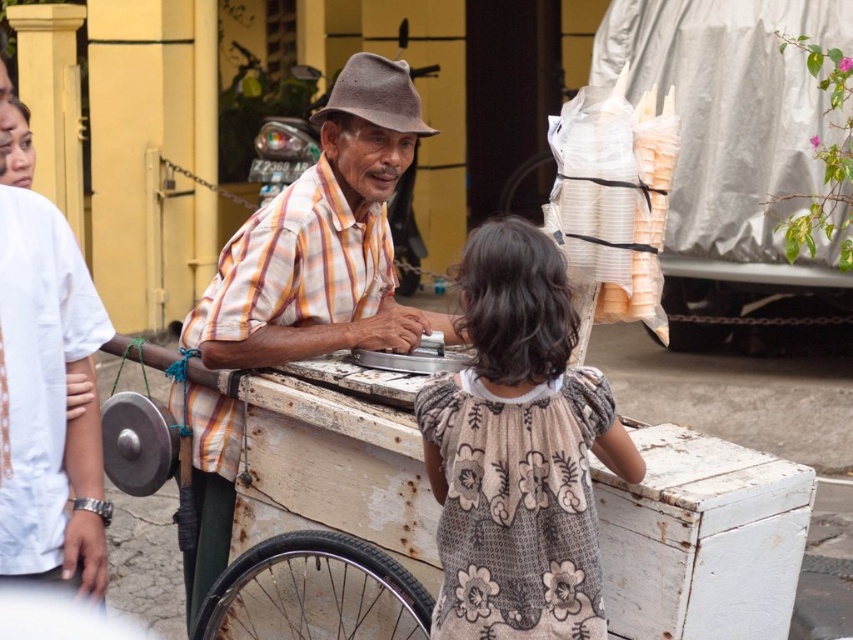
Is white weathered cart at center taller than plaid shirt at center?

Incorrect, white weathered cart at center's height is not larger of plaid shirt at center's.

Does white weathered cart at center appear under plaid shirt at center?

Correct, white weathered cart at center is located below plaid shirt at center.

Which is in front, point (291, 524) or point (231, 268)?

Point (231, 268) is in front.

Find the location of a particular element. The height and width of the screenshot is (640, 853). white weathered cart at center is located at coordinates (701, 538).

Does floral-patterned dress at center have a greater height compared to plaid shirt at center?

No.

Does floral-patterned dress at center have a lesser height compared to plaid shirt at center?

Yes.

Is point (438, 595) farther from camera compared to point (212, 410)?

No.

Find the location of a particular element. This screenshot has height=640, width=853. floral-patterned dress at center is located at coordinates (518, 451).

Is the position of white weathered cart at center less distant than that of floral-patterned dress at center?

No, it is behind floral-patterned dress at center.

Which is in front, point (653, 572) or point (572, 552)?

Point (572, 552) is more forward.

Where is `white weathered cart at center`? white weathered cart at center is located at coordinates (701, 538).